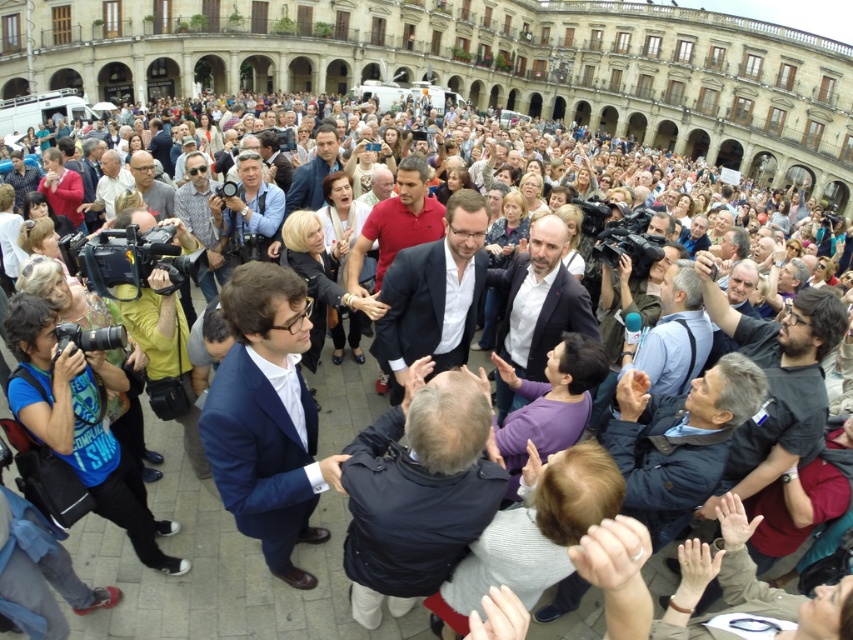
Question: Among these points, which one is farthest from the camera?

Choices:
 (A) (x=202, y=205)
 (B) (x=752, y=333)
 (C) (x=418, y=445)
 (D) (x=119, y=164)

Answer: (D)

Question: Is matte red sweater at left below light brown leather jacket at center?

Choices:
 (A) no
 (B) yes

Answer: (B)

Question: Among these points, which one is farthest from the camera?

Choices:
 (A) (479, 397)
 (B) (216, 252)
 (C) (55, 161)

Answer: (C)

Question: Does blue satin suit at center have a smaller size compared to matte red sweater at left?

Choices:
 (A) no
 (B) yes

Answer: (A)

Question: Considering the relative positions of matte blue shirt at center and matte gray suit at center in the image provided, where is matte blue shirt at center located with respect to matte gray suit at center?

Choices:
 (A) above
 (B) below

Answer: (B)

Question: Which point appears farthest from the camera in this image?

Choices:
 (A) (404, 378)
 (B) (740, 476)
 (C) (172, 196)
 (D) (218, 284)

Answer: (C)